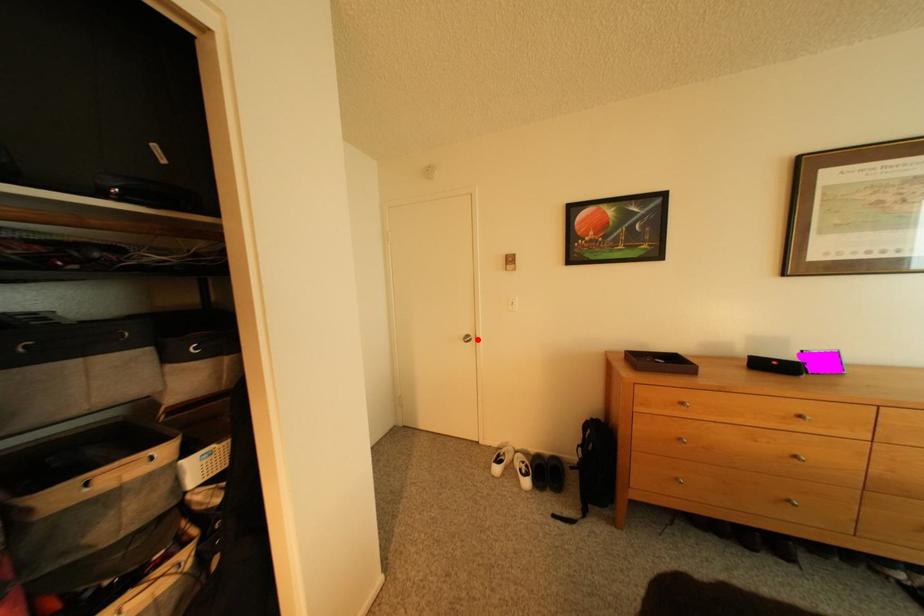
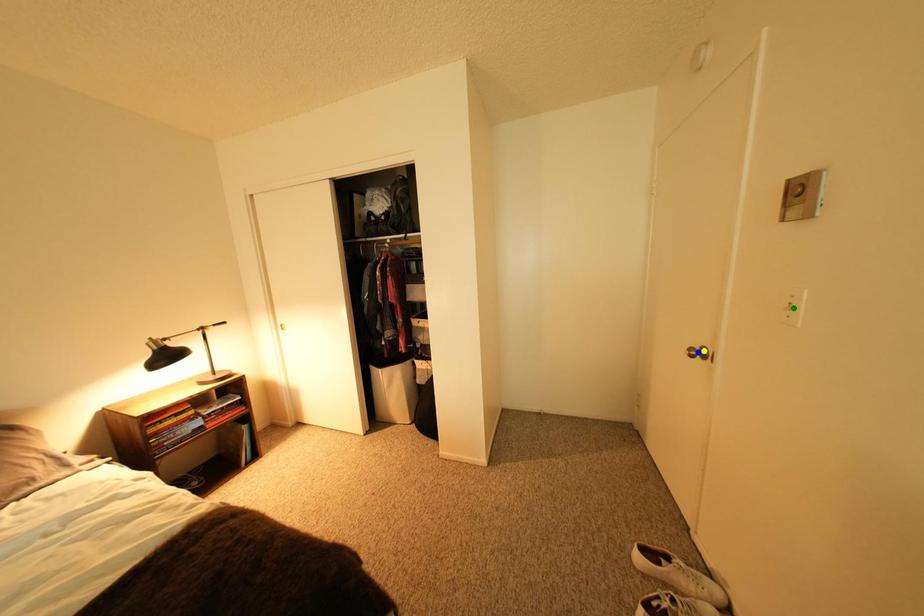
Question: I am providing you with two images of the same scene from different viewpoints. A red point is marked on the first image. You are given multiple points on the second image. In image 2, which mark is for the same physical point as the one in image 1?

Choices:
 (A) blue point
 (B) green point
 (C) yellow point

Answer: (C)